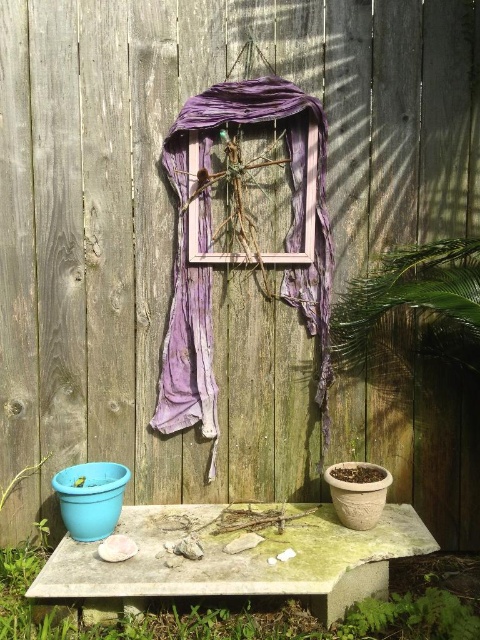
You are standing in the outdoor scene and want to place a small potted plant on the green mossy concrete at center. Can you place it directly under the wooden frame at center without moving the frame?

The green mossy concrete at center is below the wooden frame at center, so placing the potted plant there would position it directly under the frame without needing to move it.

You are a gardener who wants to plant a small shrub in the green mossy concrete at center. The shrub requires at least 30 cm of space above it to grow properly. Can the purple fabric at center provide enough clearance for the shrub to grow without obstruction?

The green mossy concrete at center is shorter than the purple fabric at center. Since the shrub needs 30 cm of space above it and the purple fabric is taller than the concrete, there should be enough clearance for the shrub to grow without touching the fabric.

You are a landscape designer planning to place a new decorative element between the green mossy concrete at center and the purple fabric at center. Given their widths, which object should you place closer to the narrower one to maintain balance?

The purple fabric at center is narrower than the green mossy concrete at center. To maintain balance, place the new decorative element closer to the purple fabric at center since it is narrower.